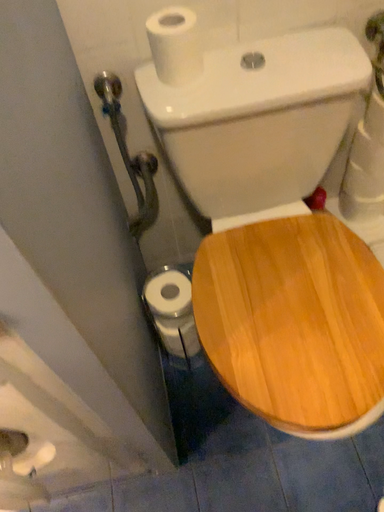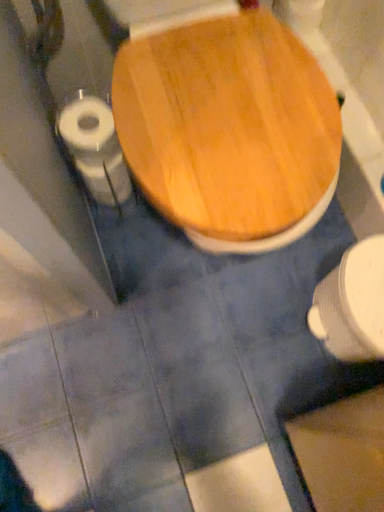
Question: Which way did the camera rotate in the video?

Choices:
 (A) rotated upward
 (B) rotated downward

Answer: (B)